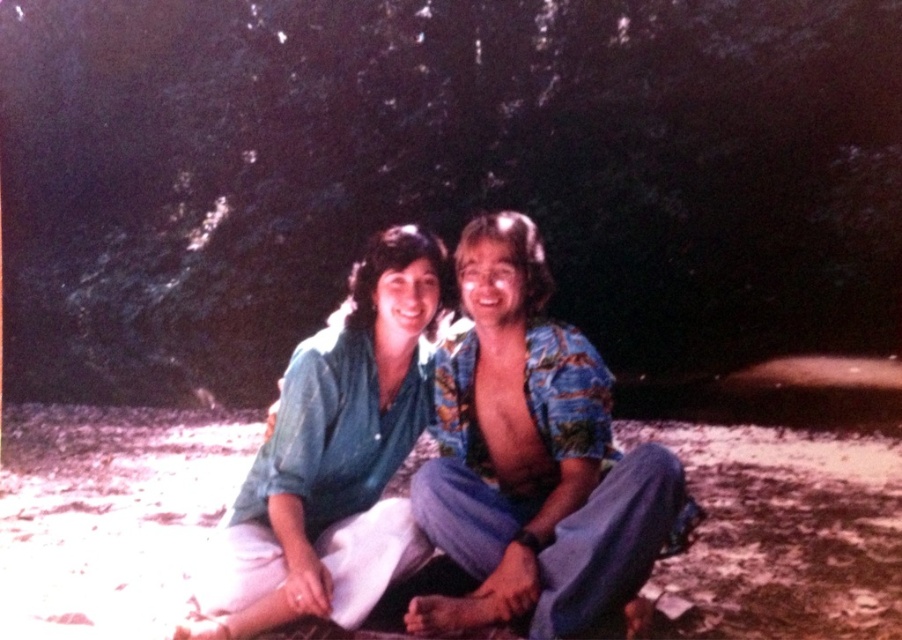
Question: Which object appears closest to the camera in this image?

Choices:
 (A) white sandy ground at center
 (B) printed fabric shirt at center

Answer: (B)

Question: Estimate the real-world distances between objects in this image. Which object is closer to the printed fabric shirt at center?

Choices:
 (A) white sandy ground at center
 (B) matte blue shirt at center

Answer: (B)

Question: Which point is farther to the camera?

Choices:
 (A) printed fabric shirt at center
 (B) white sandy ground at center

Answer: (B)

Question: Considering the relative positions of white sandy ground at center and matte blue shirt at center in the image provided, where is white sandy ground at center located with respect to matte blue shirt at center?

Choices:
 (A) above
 (B) below

Answer: (B)

Question: Can you confirm if white sandy ground at center is positioned below matte blue shirt at center?

Choices:
 (A) no
 (B) yes

Answer: (B)

Question: Can you confirm if white sandy ground at center is positioned above printed fabric shirt at center?

Choices:
 (A) no
 (B) yes

Answer: (A)